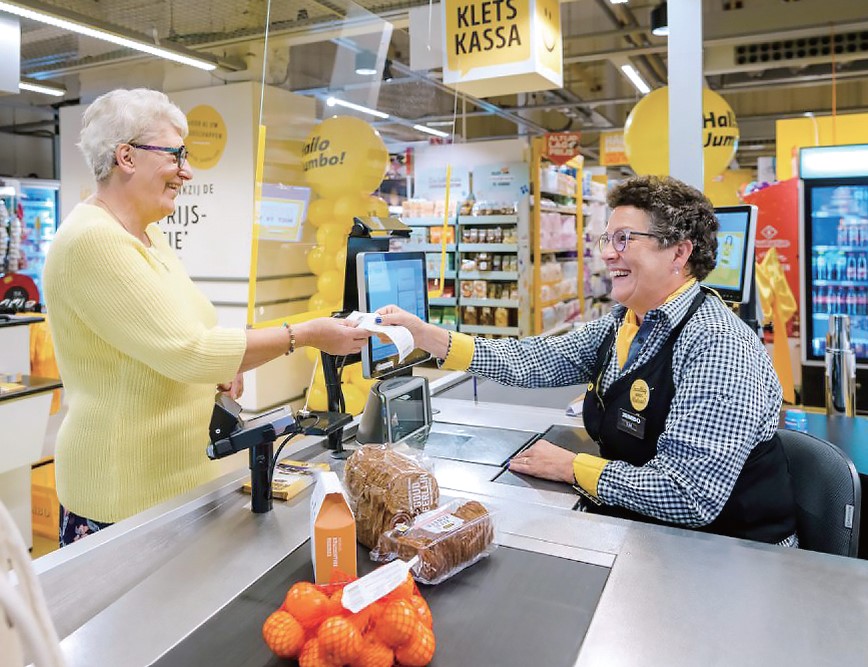
Locate an element on the screen. shelves is located at coordinates (495, 219), (491, 249), (496, 281), (496, 303), (496, 325), (445, 305), (448, 269), (448, 249), (446, 223).